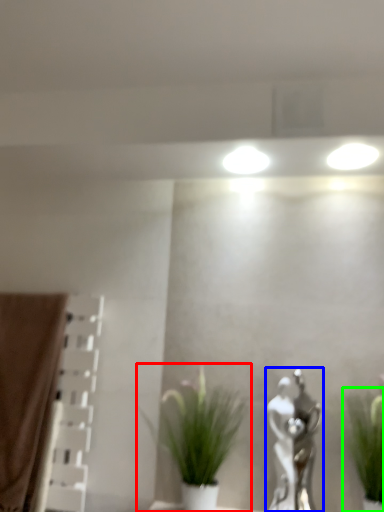
Question: Which is farther away from houseplant (highlighted by a red box)? art (highlighted by a blue box) or houseplant (highlighted by a green box)?

Choices:
 (A) art
 (B) houseplant

Answer: (B)